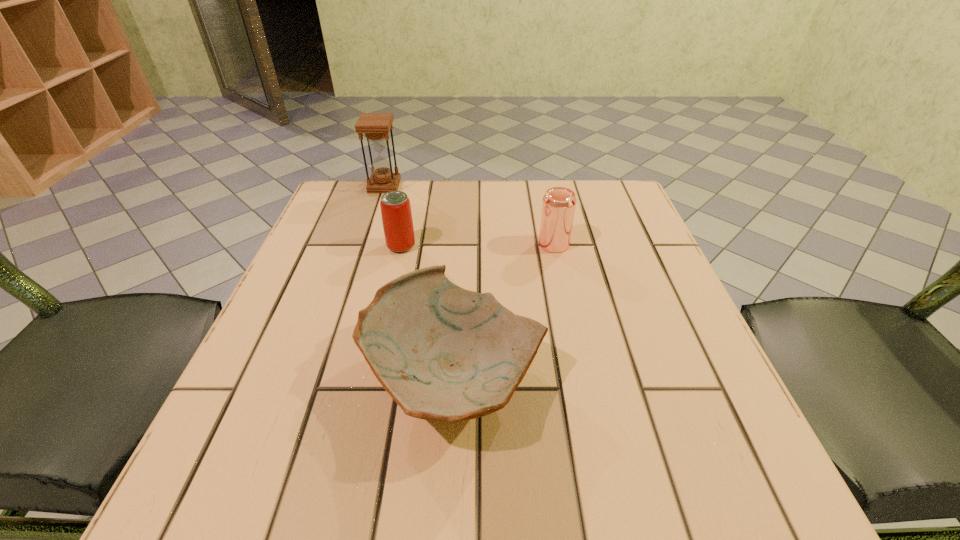
Find the location of a particular element. This screenshot has width=960, height=540. blank space at the near right corner of the desktop is located at coordinates (660, 489).

You are a GUI agent. You are given a task and a screenshot of the screen. Output one action in this format:
    pyautogui.click(x=<x>, y=<y>)
    Task: Click on the third closest object to the nearest object
    Image resolution: width=960 pixels, height=540 pixels.
    Given the screenshot: What is the action you would take?
    pyautogui.click(x=376, y=126)

This screenshot has height=540, width=960. What are the coordinates of `object that is the third nearest to the nearest object` in the screenshot? It's located at (376, 126).